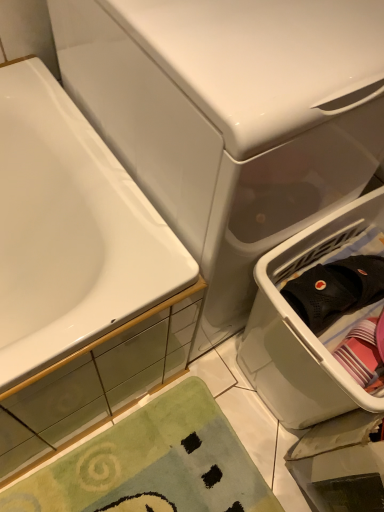
In order to click on white glossy bathtub at left in this screenshot , I will do `click(70, 233)`.

How many degrees apart are the facing directions of green plush bath mat at lower left and white glossy bathtub at left?

green plush bath mat at lower left and white glossy bathtub at left are facing 0.0928 degrees away from each other.

Would you say white glossy bathtub at left is part of green plush bath mat at lower left's contents?

Actually, white glossy bathtub at left is outside green plush bath mat at lower left.

Is point (177, 474) closer or farther from the camera than point (91, 303)?

Point (177, 474) is positioned farther from the camera compared to point (91, 303).

Which object is further away from the camera, white glossy water tank at upper center or white glossy bathtub at left?

white glossy bathtub at left is further from the camera.

Can you tell me how much white glossy water tank at upper center and white glossy bathtub at left differ in facing direction?

white glossy water tank at upper center and white glossy bathtub at left are facing 0.706 degrees away from each other.

Looking at their sizes, would you say white glossy water tank at upper center is wider or thinner than white glossy bathtub at left?

Considering their sizes, white glossy water tank at upper center looks slimmer than white glossy bathtub at left.

Between white glossy water tank at upper center and white glossy bathtub at left, which one appears on the left side from the viewer's perspective?

Positioned to the left is white glossy bathtub at left.

How distant is white glossy bathtub at left from white glossy water tank at upper center?

They are 8.76 inches apart.

Could you tell me if white glossy bathtub at left is turned towards white glossy water tank at upper center?

No, white glossy bathtub at left is not aimed at white glossy water tank at upper center.

Which object is positioned more to the left, white glossy bathtub at left or white glossy water tank at upper center?

From the viewer's perspective, white glossy bathtub at left appears more on the left side.

In terms of width, does white glossy bathtub at left look wider or thinner when compared to white glossy water tank at upper center?

In the image, white glossy bathtub at left appears to be wider than white glossy water tank at upper center.

From the image's perspective, which one is positioned higher, green plush bath mat at lower left or black mesh clothing at right?

black mesh clothing at right appears higher in the image.

Locate an element on the screen. The height and width of the screenshot is (512, 384). clothing on the right side of green plush bath mat at lower left is located at coordinates (335, 290).

Considering the sizes of objects green plush bath mat at lower left and black mesh clothing at right in the image provided, who is bigger, green plush bath mat at lower left or black mesh clothing at right?

green plush bath mat at lower left.

Based on the photo, is green plush bath mat at lower left in contact with black mesh clothing at right?

No, green plush bath mat at lower left is not next to black mesh clothing at right.

This screenshot has height=512, width=384. What are the coordinates of `bath mat that appears below the white glossy water tank at upper center (from a real-world perspective)` in the screenshot? It's located at (153, 464).

Is the surface of green plush bath mat at lower left in direct contact with white glossy water tank at upper center?

They are not placed beside each other.

Is green plush bath mat at lower left oriented towards white glossy water tank at upper center?

No, green plush bath mat at lower left is not facing towards white glossy water tank at upper center.

Is green plush bath mat at lower left shorter than white glossy water tank at upper center?

Correct, green plush bath mat at lower left is not as tall as white glossy water tank at upper center.

Can you tell me how much white glossy bathtub at left and black mesh clothing at right differ in facing direction?

There is a 102-degree angle between the facing directions of white glossy bathtub at left and black mesh clothing at right.

Is the position of white glossy bathtub at left more distant than that of black mesh clothing at right?

No, white glossy bathtub at left is closer to the viewer.

Does white glossy bathtub at left have a larger size compared to black mesh clothing at right?

Yes, white glossy bathtub at left is bigger than black mesh clothing at right.

Where is `laundry basket below the white glossy water tank at upper center (from a real-world perspective)`? This screenshot has width=384, height=512. laundry basket below the white glossy water tank at upper center (from a real-world perspective) is located at coordinates (305, 325).

Looking at this image, considering the sizes of objects white glossy water tank at upper center and white plastic laundry basket at right in the image provided, who is shorter, white glossy water tank at upper center or white plastic laundry basket at right?

white plastic laundry basket at right.

Is white glossy water tank at upper center positioned in front of white plastic laundry basket at right?

Yes, white glossy water tank at upper center is closer to the viewer.

Is point (147, 59) in front of point (326, 396)?

Yes.

Locate an element on the screen. Image resolution: width=384 pixels, height=512 pixels. bath mat on the right of white glossy bathtub at left is located at coordinates (153, 464).

Locate an element on the screen. The width and height of the screenshot is (384, 512). bathtub below the white glossy water tank at upper center (from the image's perspective) is located at coordinates tap(70, 233).

From the image, which object appears to be farther from white glossy bathtub at left, white plastic laundry basket at right or black mesh clothing at right?

Among the two, black mesh clothing at right is located further to white glossy bathtub at left.

Estimate the real-world distances between objects in this image. Which object is closer to white glossy bathtub at left, green plush bath mat at lower left or white glossy water tank at upper center?

The object closer to white glossy bathtub at left is white glossy water tank at upper center.

Estimate the real-world distances between objects in this image. Which object is further from white glossy bathtub at left, white glossy water tank at upper center or white plastic laundry basket at right?

Among the two, white plastic laundry basket at right is located further to white glossy bathtub at left.

Looking at the image, which one is located closer to green plush bath mat at lower left, white plastic laundry basket at right or black mesh clothing at right?

Based on the image, white plastic laundry basket at right appears to be nearer to green plush bath mat at lower left.

Considering their positions, is white glossy water tank at upper center positioned closer to green plush bath mat at lower left than white plastic laundry basket at right?

Among the two, white plastic laundry basket at right is located nearer to green plush bath mat at lower left.

Looking at the image, which one is located further to white plastic laundry basket at right, black mesh clothing at right or white glossy bathtub at left?

white glossy bathtub at left.

When comparing their distances from black mesh clothing at right, does green plush bath mat at lower left or white glossy water tank at upper center seem further?

green plush bath mat at lower left.

Which object lies nearer to the anchor point white glossy water tank at upper center, white plastic laundry basket at right or black mesh clothing at right?

white plastic laundry basket at right.

This screenshot has height=512, width=384. I want to click on water tank between white glossy bathtub at left and white plastic laundry basket at right, so click(x=231, y=118).

At what (x,y) coordinates should I click in order to perform the action: click on laundry basket between black mesh clothing at right and green plush bath mat at lower left vertically. Please return your answer as a coordinate pair (x, y). This screenshot has width=384, height=512. Looking at the image, I should click on (305, 325).

I want to click on bath mat between white glossy bathtub at left and white plastic laundry basket at right from left to right, so click(153, 464).

You are a GUI agent. You are given a task and a screenshot of the screen. Output one action in this format:
    pyautogui.click(x=<x>, y=<y>)
    Task: Click on the laundry basket between white glossy water tank at upper center and green plush bath mat at lower left in the up-down direction
    
    Given the screenshot: What is the action you would take?
    pyautogui.click(x=305, y=325)